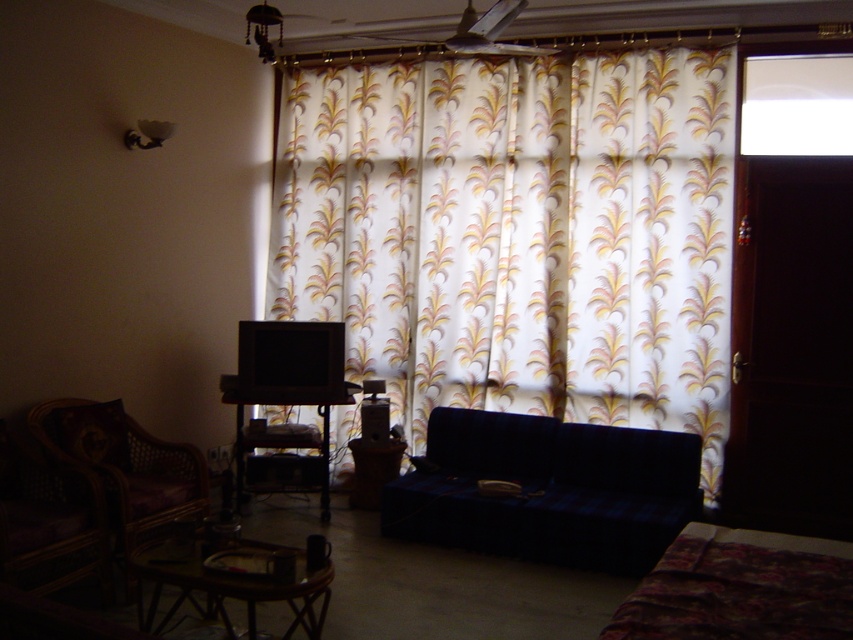
Question: Can you confirm if velvet blue couch at center is positioned above matte white lampshade at upper left?

Choices:
 (A) yes
 (B) no

Answer: (B)

Question: Which point is closer to the camera?

Choices:
 (A) (596, 317)
 (B) (279, 22)
 (C) (142, 618)
 (D) (482, 460)

Answer: (C)

Question: Is white printed fabric curtain at center further to the viewer compared to matte white lampshade at upper left?

Choices:
 (A) yes
 (B) no

Answer: (A)

Question: Which of these objects is positioned farthest from the velvet blue couch at center?

Choices:
 (A) matte white lampshade at upper left
 (B) wooden table at lower center
 (C) metallic lampshade at upper center
 (D) white printed fabric curtain at center

Answer: (C)

Question: Which object is the farthest from the velvet blue couch at center?

Choices:
 (A) white printed fabric curtain at center
 (B) matte white lampshade at upper left

Answer: (B)

Question: Is white printed fabric curtain at center smaller than wooden table at lower center?

Choices:
 (A) yes
 (B) no

Answer: (B)